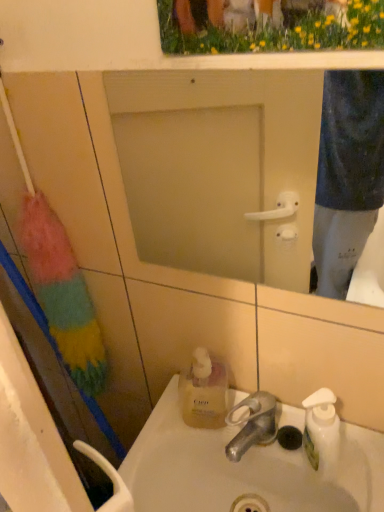
The width and height of the screenshot is (384, 512). What do you see at coordinates (252, 424) in the screenshot?
I see `silver metallic faucet at sink center` at bounding box center [252, 424].

The image size is (384, 512). Identify the location of silver metallic faucet at sink center. (252, 424).

Can you confirm if silver metallic faucet at sink center is bigger than yellow grass at upper center?

Actually, silver metallic faucet at sink center might be smaller than yellow grass at upper center.

Can you confirm if silver metallic faucet at sink center is wider than yellow grass at upper center?

Yes, silver metallic faucet at sink center is wider than yellow grass at upper center.

Can white glossy sink at center be found inside translucent yellow liquid at sink center?

That's incorrect, white glossy sink at center is not inside translucent yellow liquid at sink center.

Considering their positions, is translucent yellow liquid at sink center located in front of or behind white glossy sink at center?

In the image, translucent yellow liquid at sink center appears behind white glossy sink at center.

How many degrees apart are the facing directions of translucent yellow liquid at sink center and white glossy sink at center?

0.00344 degrees.

From a real-world perspective, is translucent yellow liquid at sink center beneath white glossy sink at center?

No, from a real-world perspective, translucent yellow liquid at sink center is not beneath white glossy sink at center.

Identify the location of sink below the frosted glass mirror at center (from the image's perspective). The image size is (384, 512). (245, 469).

Is white glossy sink at center positioned with its back to frosted glass mirror at center?

white glossy sink at center is not turned away from frosted glass mirror at center.

Find the location of a particular element. bottle that appears on the left of white glossy sink at center is located at coordinates tap(204, 392).

Relative to translucent yellow liquid at sink center, is white glossy sink at center in front or behind?

Clearly, white glossy sink at center is in front of translucent yellow liquid at sink center.

Which of these two, white glossy sink at center or translucent yellow liquid at sink center, stands shorter?

white glossy sink at center is shorter.

Is white glossy sink at center in contact with translucent yellow liquid at sink center?

No, white glossy sink at center is not touching translucent yellow liquid at sink center.

Consider the image. From the image's perspective, which object appears higher, silver metallic faucet at sink center or frosted glass mirror at center?

frosted glass mirror at center is shown above in the image.

Which point is more distant from viewer, (x=238, y=423) or (x=174, y=203)?

Positioned behind is point (x=174, y=203).

Between silver metallic faucet at sink center and frosted glass mirror at center, which one has larger width?

silver metallic faucet at sink center is wider.

Is white glossy sink at center to the right of silver metallic faucet at sink center from the viewer's perspective?

Incorrect, white glossy sink at center is not on the right side of silver metallic faucet at sink center.

This screenshot has width=384, height=512. In order to click on tap that appears behind the white glossy sink at center in this screenshot , I will do `click(252, 424)`.

From a real-world perspective, which object rests below the other?

white glossy sink at center is physically lower.

Considering the sizes of objects yellow grass at upper center and frosted glass mirror at center in the image provided, who is bigger, yellow grass at upper center or frosted glass mirror at center?

With larger size is frosted glass mirror at center.

Can you see yellow grass at upper center touching frosted glass mirror at center?

There is a gap between yellow grass at upper center and frosted glass mirror at center.

In the image, there is a yellow grass at upper center. Where is `mirror below it (from a real-world perspective)`? This screenshot has height=512, width=384. mirror below it (from a real-world perspective) is located at coordinates (219, 168).

At what (x,y) coordinates should I click in order to perform the action: click on tap located below the yellow grass at upper center (from the image's perspective). Please return your answer as a coordinate pair (x, y). Looking at the image, I should click on (x=252, y=424).

Where is `bottle behind the white glossy sink at center`? bottle behind the white glossy sink at center is located at coordinates (204, 392).

Looking at the image, which one is located further to translucent yellow liquid at sink center, frosted glass mirror at center or silver metallic faucet at sink center?

frosted glass mirror at center.

Which object lies further to the anchor point silver metallic faucet at sink center, yellow grass at upper center or translucent yellow liquid at sink center?

yellow grass at upper center is further to silver metallic faucet at sink center.

Based on their spatial positions, is white glossy sink at center or silver metallic faucet at sink center closer to yellow grass at upper center?

The object closer to yellow grass at upper center is silver metallic faucet at sink center.

From the image, which object appears to be farther from silver metallic faucet at sink center, white glossy sink at center or yellow grass at upper center?

Based on the image, yellow grass at upper center appears to be further to silver metallic faucet at sink center.

When comparing their distances from white glossy sink at center, does silver metallic faucet at sink center or yellow grass at upper center seem closer?

silver metallic faucet at sink center is closer to white glossy sink at center.

From the image, which object appears to be farther from silver metallic faucet at sink center, yellow grass at upper center or frosted glass mirror at center?

yellow grass at upper center is further to silver metallic faucet at sink center.

Based on the photo, based on their spatial positions, is translucent yellow liquid at sink center or frosted glass mirror at center closer to silver metallic faucet at sink center?

translucent yellow liquid at sink center lies closer to silver metallic faucet at sink center than the other object.

Which object lies further to the anchor point white glossy sink at center, yellow grass at upper center or frosted glass mirror at center?

The object further to white glossy sink at center is yellow grass at upper center.

Find the location of a particular element. bottle between frosted glass mirror at center and silver metallic faucet at sink center vertically is located at coordinates (204, 392).

This screenshot has height=512, width=384. Identify the location of mirror between yellow grass at upper center and silver metallic faucet at sink center vertically. [x=219, y=168].

Find the location of a particular element. This screenshot has width=384, height=512. tap between yellow grass at upper center and white glossy sink at center in the up-down direction is located at coordinates (252, 424).

The height and width of the screenshot is (512, 384). In order to click on bottle that lies between frosted glass mirror at center and white glossy sink at center from top to bottom in this screenshot , I will do coord(204,392).